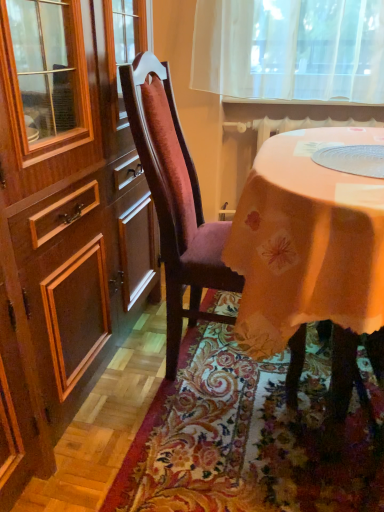
Find the location of a particular element. This screenshot has width=384, height=512. free point in front of velvet burgundy chair at center is located at coordinates (228, 444).